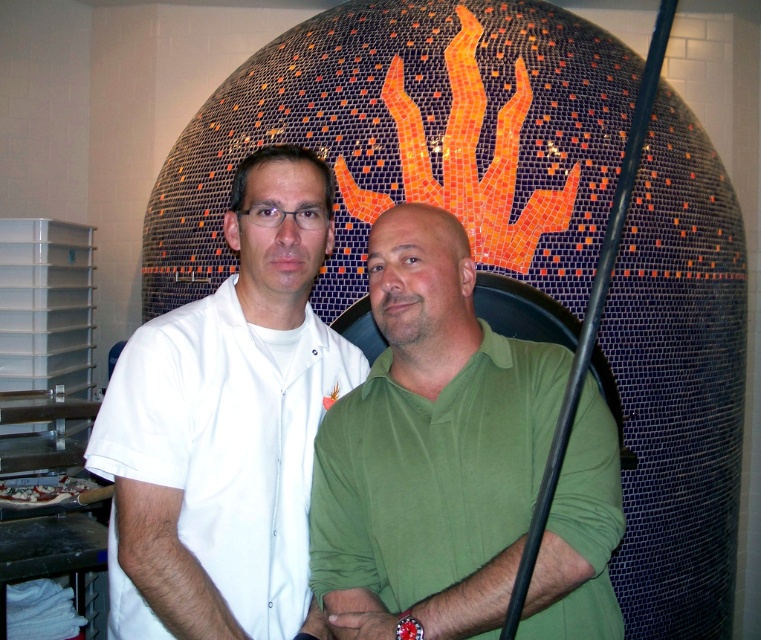
Question: Does white smooth shirt at center appear over white glossy pizza at lower left?

Choices:
 (A) no
 (B) yes

Answer: (B)

Question: Which point is farther from the camera taking this photo?

Choices:
 (A) (27, 497)
 (B) (489, 596)
 (C) (276, 289)

Answer: (A)

Question: Based on their relative distances, which object is nearer to the white smooth shirt at center?

Choices:
 (A) green matte shirt at center
 (B) white glossy pizza at lower left

Answer: (A)

Question: Does white smooth shirt at center have a smaller size compared to white glossy pizza at lower left?

Choices:
 (A) no
 (B) yes

Answer: (A)

Question: Estimate the real-world distances between objects in this image. Which object is farther from the green matte shirt at center?

Choices:
 (A) white glossy pizza at lower left
 (B) white smooth shirt at center

Answer: (A)

Question: Does green matte shirt at center have a greater width compared to white glossy pizza at lower left?

Choices:
 (A) no
 (B) yes

Answer: (B)